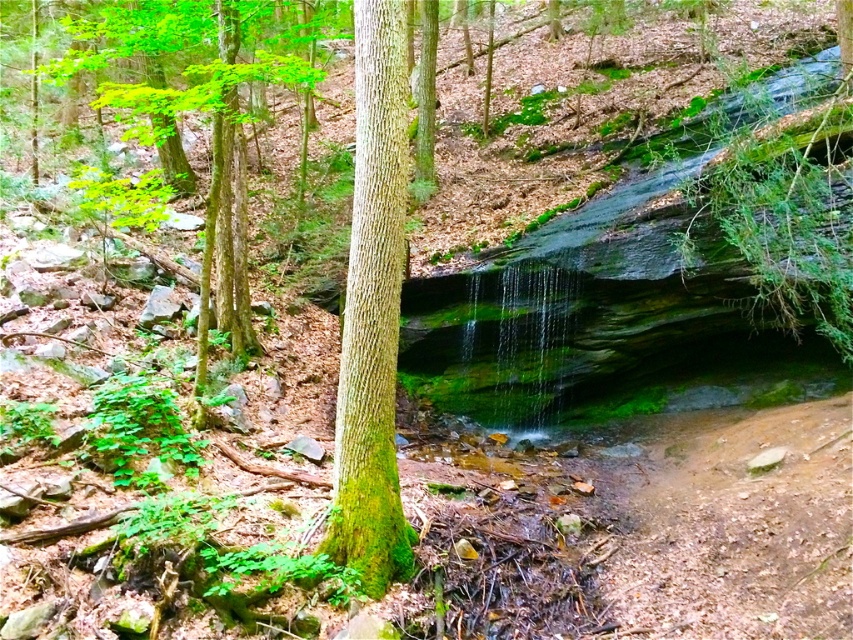
Question: Is green mossy bark tree at center bigger than green mossy tree at left?

Choices:
 (A) yes
 (B) no

Answer: (A)

Question: Is green mossy bark tree at center above green mossy tree at left?

Choices:
 (A) no
 (B) yes

Answer: (A)

Question: Which object is closer to the camera taking this photo?

Choices:
 (A) green mossy bark tree at center
 (B) green mossy tree at left

Answer: (A)

Question: Does green mossy bark tree at center have a greater width compared to green mossy tree at left?

Choices:
 (A) no
 (B) yes

Answer: (B)

Question: Which point is farther to the camera?

Choices:
 (A) green mossy bark tree at center
 (B) green mossy tree at left

Answer: (B)

Question: Which of the following is the farthest from the observer?

Choices:
 (A) (392, 180)
 (B) (164, 140)

Answer: (B)